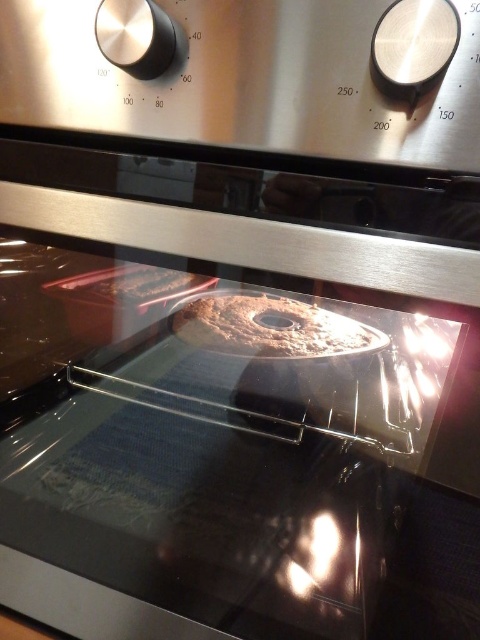
You are a baker checking the oven. You see the golden brown doughnut at center and the matte brown tray at left. Which object is larger in size?

The golden brown doughnut at center is bigger than the matte brown tray at left.

You are a chef checking the oven. You need to adjust the temperature knob located at the brushed metal oven knobs at upper center. To reach it, you have to move your hand over the matte brown tray at left. Is the path between the two objects clear?

The brushed metal oven knobs at upper center is positioned over the matte brown tray at left, meaning there is a clear vertical path between them. Since the tray is below the knobs, your hand can reach the knobs without obstruction from the tray.

You are standing 18 inches away from the oven. You want to reach the point inside the oven labeled as point (28, 4). Can you safely extend your hand to touch it without reaching beyond the oven?

The distance of point (28, 4) from camera is 16.45 inches. Since you are standing 18 inches away from the oven, your hand would need to reach 18 inches plus the oven depth to touch the point. However, the given distance is only 16.45 inches from the camera, which likely measures from the oven opening. Thus, extending your hand 16.45 inches into the oven from the door would be possible if the oven depth allows, but safety depends on oven temperature and your reach capability.